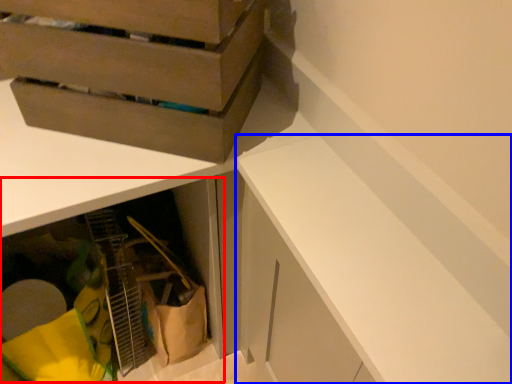
Question: Which of the following is the closest to the observer, cabinetry (highlighted by a red box) or cabinetry (highlighted by a blue box)?

Choices:
 (A) cabinetry
 (B) cabinetry

Answer: (B)